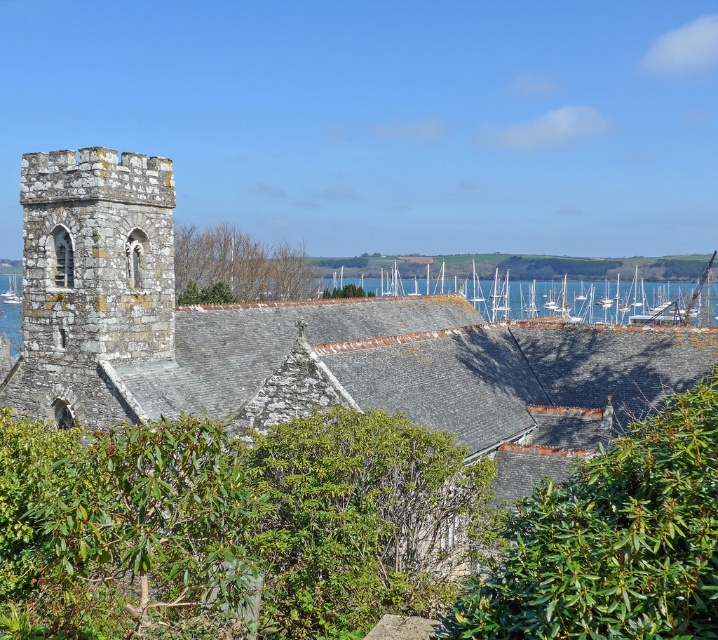
You are a photographer planning to capture the stone church at left and the stone tower at left in a single shot. Based on their heights, which one should you focus on to ensure both are fully visible in the frame?

The stone church at left is taller than the stone tower at left, so you should focus on the stone church at left to ensure both are fully visible in the frame.

Consider the image. You are a photographer trying to capture the historic stone church on the left. You notice the green leafy bush at center and the bare branches at upper center in your shot. Which object is closer to your camera lens?

The green leafy bush at center is closer to the camera lens because it is positioned in front of the bare branches at upper center.

You are a photographer standing at the edge of a lake, and you want to capture both the stone tower at left and the white wooden boats at center in a single shot. Based on their positions, which object should you position closer to the left side of your camera frame?

The stone tower at left should be positioned closer to the left side of your camera frame since it is already located to the left of the white wooden boats at center in the scene.